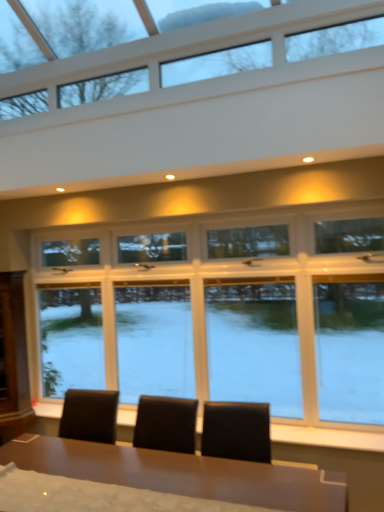
Question: From a real-world perspective, relative to clear glass window at center, which appears as the 2th window when viewed from the top, is shiny brown table at center vertically above or below?

Choices:
 (A) above
 (B) below

Answer: (B)

Question: Is shiny brown table at center inside or outside of clear glass window at center, which appears as the 2th window when viewed from the top?

Choices:
 (A) inside
 (B) outside

Answer: (B)

Question: Estimate the real-world distances between objects in this image. Which object is farther from the clear glass window at upper center, positioned as the first window in top-to-bottom order?

Choices:
 (A) shiny brown table at center
 (B) clear glass window at center, which is the first window from bottom to top

Answer: (A)

Question: Which of these objects is positioned farthest from the clear glass window at upper center, positioned as the first window in top-to-bottom order?

Choices:
 (A) clear glass window at center, which appears as the 2th window when viewed from the top
 (B) shiny brown table at center

Answer: (B)